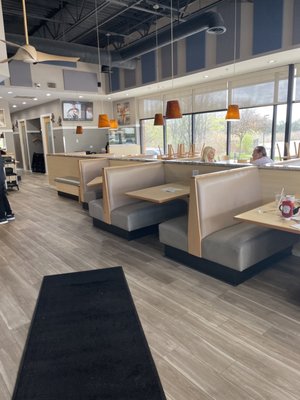
Locate an element on the screen. The height and width of the screenshot is (400, 300). clear plastic cup of a clear beverage is located at coordinates (280, 196).